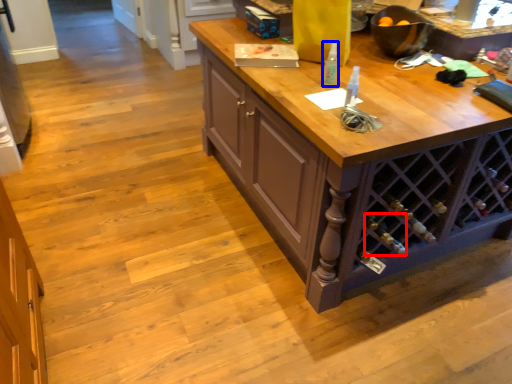
Question: Among these objects, which one is nearest to the camera, wine bottle (highlighted by a red box) or bottle (highlighted by a blue box)?

Choices:
 (A) wine bottle
 (B) bottle

Answer: (B)